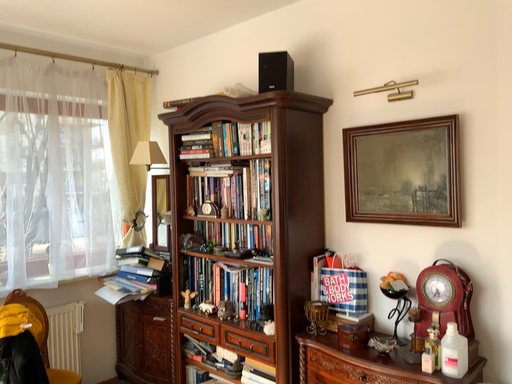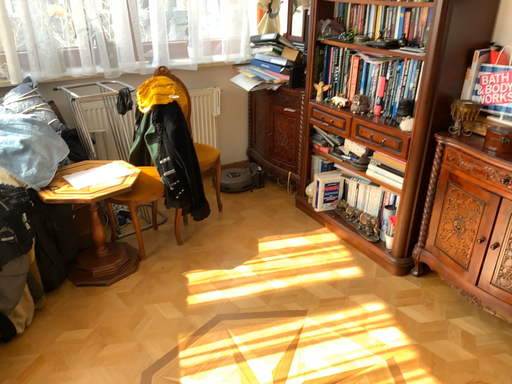
Question: Which way did the camera rotate in the video?

Choices:
 (A) rotated right
 (B) rotated left

Answer: (B)